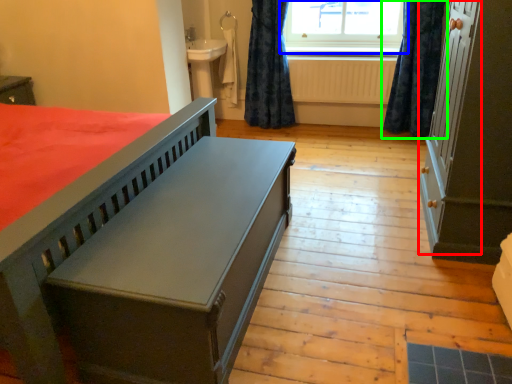
Question: Which object is the farthest from screen door (highlighted by a red box)? Choose among these: window (highlighted by a blue box) or curtain (highlighted by a green box).

Choices:
 (A) window
 (B) curtain

Answer: (A)